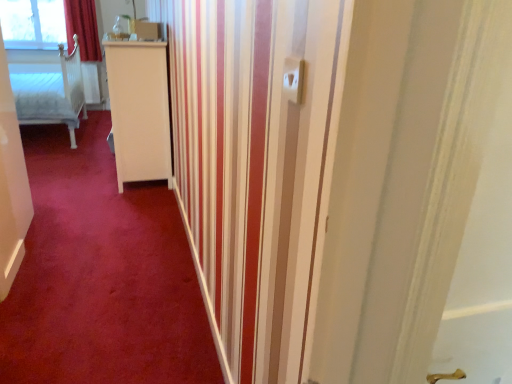
Question: Would you say red carpet at center is to the left or to the right of red velvet curtain at upper left in the picture?

Choices:
 (A) right
 (B) left

Answer: (A)

Question: From the image's perspective, is red carpet at center located above or below red velvet curtain at upper left?

Choices:
 (A) below
 (B) above

Answer: (A)

Question: Which is farther from the transparent glass window at upper left?

Choices:
 (A) white wooden bed at left
 (B) white plastic electric outlet at upper center
 (C) red velvet curtain at upper left
 (D) red carpet at center

Answer: (B)

Question: Which is farther from the white plastic electric outlet at upper center?

Choices:
 (A) red velvet curtain at upper left
 (B) transparent glass window at upper left
 (C) white wooden bed at left
 (D) red carpet at center

Answer: (B)